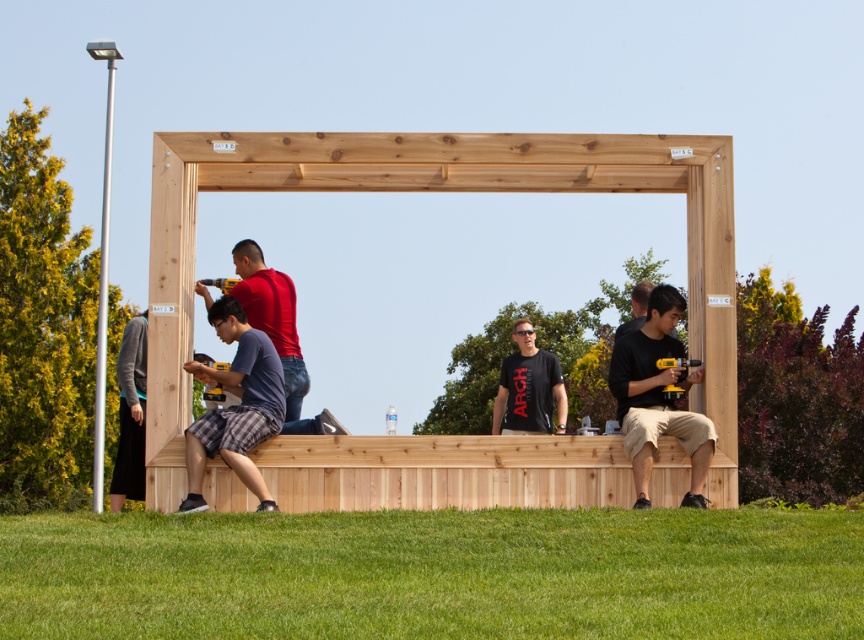
You are standing at the position of the matte red shirt at center and want to reach the natural wood frame at center to assist with the construction. Given that you can comfortably extend your arm 2 feet, can you reach the frame without moving your feet?

The distance between the natural wood frame at center and the matte red shirt at center is 6.52 feet, which is greater than your 2 feet arm extension. Therefore, you cannot reach the frame without moving your feet.

Consider the image. You are a photographer standing at the edge of the grassy area. You need to capture a photo that includes both the matte black shirt at center and the dark gray sweater at left. Which person should be positioned closer to the camera to ensure both are fully visible in the frame?

The matte black shirt at center should be positioned closer to the camera because its width surpasses that of the dark gray sweater at left, so bringing it forward ensures both fit within the frame.